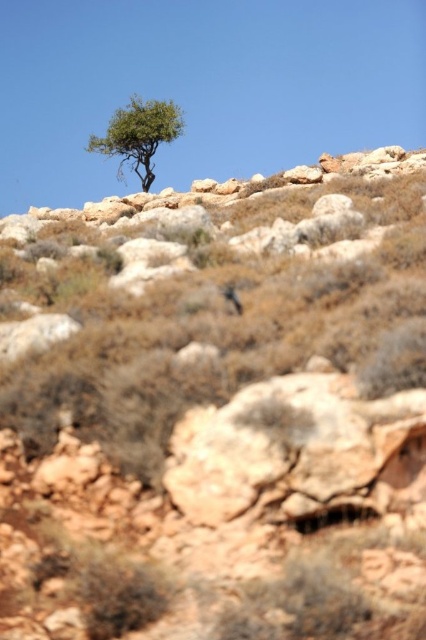
Based on the photo, you are a hiker trying to navigate through the desert. You see the rusty rock at center and the green leafy tree at upper center. Which object is positioned to the right of the other?

The rusty rock at center is to the right of the green leafy tree at upper center.

You are a hiker trying to navigate through this desert landscape. You need to determine which object is taller between the rusty rock at center and the green leafy tree at upper center. Based on the scene, which one is taller?

The green leafy tree at upper center is taller than the rusty rock at center.